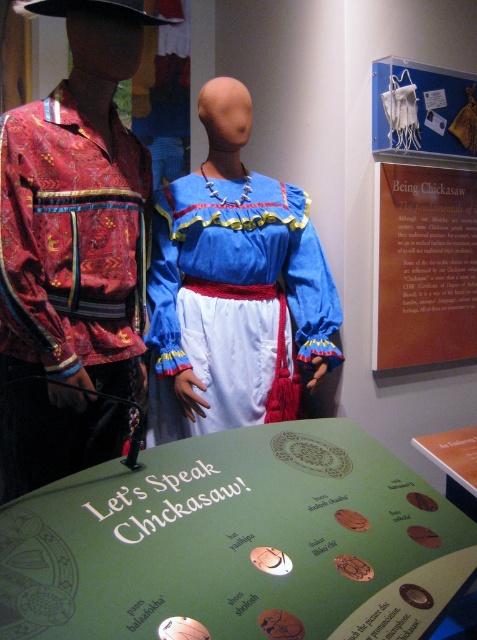
You are a visitor at the Chickasaw cultural exhibit and want to read the green cardboard sign at center. Which mannequin, the matte red fabric shirt at left or the one on the right, is closer to the sign?

The green cardboard sign at center is to the right of the matte red fabric shirt at left, so the sign is closer to the mannequin on the right.

You are a visitor at the Chickasaw cultural exhibit and notice the matte red fabric shirt at left and the brown paper sign at upper center. Which object is positioned more to the left side of the display?

The matte red fabric shirt at left is positioned more to the left side of the display than the brown paper sign at upper center.